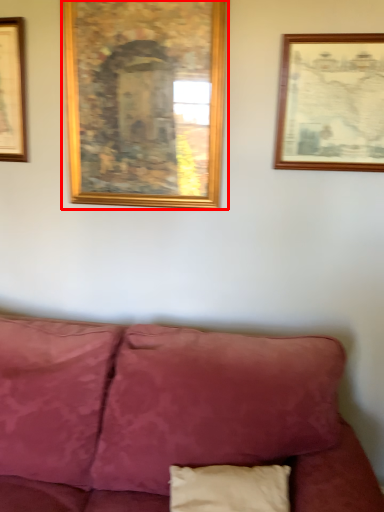
Question: Observing the image, what is the correct spatial positioning of picture frame (annotated by the red box) in reference to picture frame?

Choices:
 (A) left
 (B) right

Answer: (A)